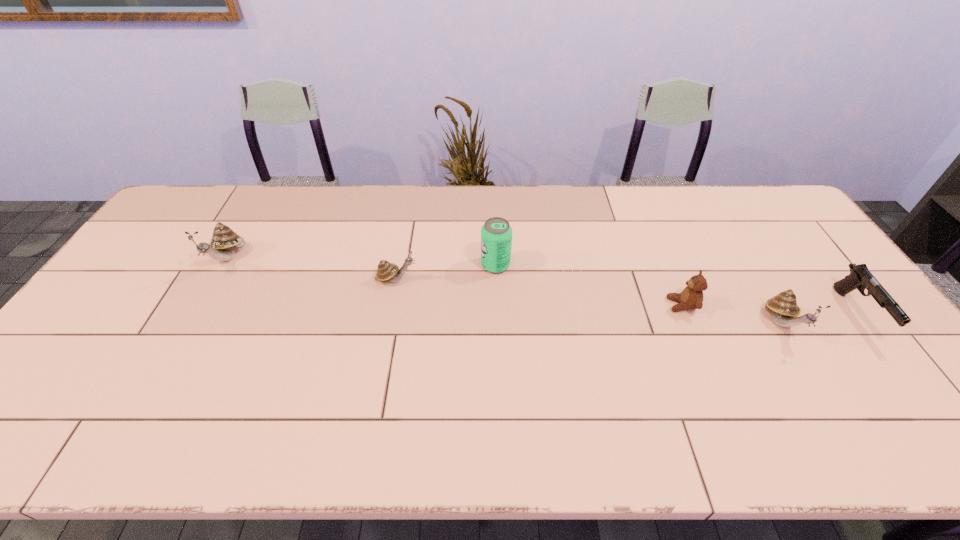
Locate an element on the screen. The width and height of the screenshot is (960, 540). free point located 0.140m on the face of the second shortest snail is located at coordinates (826, 396).

Identify the location of free space located 0.180m on the front-facing side of the fourth object from right to left. The image size is (960, 540). (421, 265).

You are a GUI agent. You are given a task and a screenshot of the screen. Output one action in this format:
    pyautogui.click(x=<x>, y=<y>)
    Task: Click on the free space located on the front-facing side of the fourth object from right to left
    Image resolution: width=960 pixels, height=540 pixels.
    Given the screenshot: What is the action you would take?
    pyautogui.click(x=369, y=265)

At what (x,y) coordinates should I click in order to perform the action: click on vacant space located on the front-facing side of the fourth object from right to left. Please return your answer as a coordinate pair (x, y). This screenshot has height=540, width=960. Looking at the image, I should click on (392, 265).

Locate an element on the screen. The width and height of the screenshot is (960, 540). vacant space located 0.120m at the face of the third object from right to left is located at coordinates (625, 305).

Locate an element on the screen. free location located at the face of the third object from right to left is located at coordinates (582, 305).

Image resolution: width=960 pixels, height=540 pixels. Find the location of `free location located at the face of the third object from right to left`. free location located at the face of the third object from right to left is located at coordinates (560, 305).

Find the location of a particular element. This screenshot has width=960, height=540. vacant region located 0.060m at the aiming end of the gun is located at coordinates (896, 366).

The image size is (960, 540). I want to click on object that is positioned at the right edge, so click(860, 277).

Locate an element on the screen. The width and height of the screenshot is (960, 540). vacant space at the far edge of the desktop is located at coordinates (564, 187).